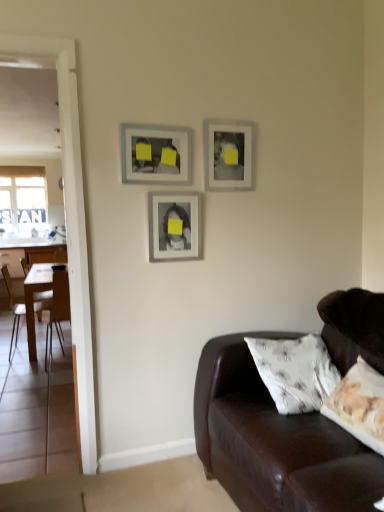
Question: Does matte silver picture frame at center, the second picture frame positioned from the right, have a lesser height compared to wooden chair at left, placed as the first chair when sorted from right to left?

Choices:
 (A) yes
 (B) no

Answer: (A)

Question: Does matte silver picture frame at center, which is counted as the 2th picture frame, starting from the left, have a lesser width compared to wooden chair at left, placed as the first chair when sorted from right to left?

Choices:
 (A) yes
 (B) no

Answer: (A)

Question: From the image's perspective, is matte silver picture frame at center, the second picture frame positioned from the right, under wooden chair at left, which is the second chair in left-to-right order?

Choices:
 (A) no
 (B) yes

Answer: (A)

Question: From the image's perspective, is matte silver picture frame at center, the second picture frame positioned from the right, above wooden chair at left, which is the second chair in left-to-right order?

Choices:
 (A) no
 (B) yes

Answer: (B)

Question: Can you confirm if matte silver picture frame at center, which is counted as the 2th picture frame, starting from the left, is smaller than wooden chair at left, placed as the first chair when sorted from right to left?

Choices:
 (A) yes
 (B) no

Answer: (A)

Question: From a real-world perspective, is white glossy table at left physically located above or below matte gray picture frame at upper center, which appears as the 1th picture frame when viewed from the right?

Choices:
 (A) above
 (B) below

Answer: (B)

Question: Is white glossy table at left spatially inside matte gray picture frame at upper center, which ranks as the 3th picture frame in left-to-right order, or outside of it?

Choices:
 (A) inside
 (B) outside

Answer: (B)

Question: Relative to matte gray picture frame at upper center, which ranks as the 3th picture frame in left-to-right order, is white glossy table at left in front or behind?

Choices:
 (A) front
 (B) behind

Answer: (B)

Question: From their relative heights in the image, would you say white glossy table at left is taller or shorter than matte gray picture frame at upper center, which ranks as the 3th picture frame in left-to-right order?

Choices:
 (A) short
 (B) tall

Answer: (B)

Question: Is matte gray picture frame at upper center, which ranks as the 3th picture frame in left-to-right order, wider or thinner than light brown wooden chair at left, the 1th chair in the left-to-right sequence?

Choices:
 (A) thin
 (B) wide

Answer: (A)

Question: Would you say matte gray picture frame at upper center, which appears as the 1th picture frame when viewed from the right, is to the left or to the right of light brown wooden chair at left, the 1th chair in the left-to-right sequence, in the picture?

Choices:
 (A) right
 (B) left

Answer: (A)

Question: Is matte gray picture frame at upper center, which ranks as the 3th picture frame in left-to-right order, inside or outside of light brown wooden chair at left, the 1th chair in the left-to-right sequence?

Choices:
 (A) inside
 (B) outside

Answer: (B)

Question: Considering the positions of point (221, 126) and point (31, 289), is point (221, 126) closer or farther from the camera than point (31, 289)?

Choices:
 (A) closer
 (B) farther

Answer: (A)

Question: Considering the positions of point (188, 181) and point (31, 336), is point (188, 181) closer or farther from the camera than point (31, 336)?

Choices:
 (A) farther
 (B) closer

Answer: (B)

Question: In terms of size, does matte black picture frame at upper center, which is counted as the 3th picture frame, starting from the right, appear bigger or smaller than white glossy table at left?

Choices:
 (A) small
 (B) big

Answer: (A)